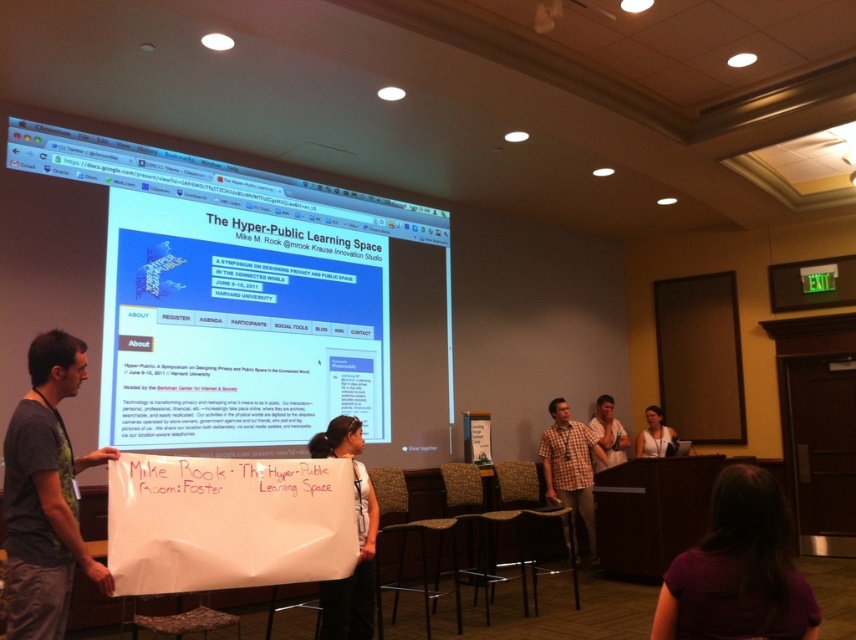
Question: Which point is closer to the camera taking this photo?

Choices:
 (A) (366, 634)
 (B) (646, 417)
 (C) (550, 445)

Answer: (A)

Question: Can you confirm if purple fabric shirt at lower center is positioned above white paperboard at center?

Choices:
 (A) yes
 (B) no

Answer: (A)

Question: Can you confirm if purple fabric shirt at lower center is wider than white paperboard at center?

Choices:
 (A) yes
 (B) no

Answer: (A)

Question: Based on their relative distances, which object is farther from the plaid shirt at center?

Choices:
 (A) gray fabric banner at left
 (B) checkered fabric shirt at center

Answer: (A)

Question: Which object is the closest to the white glossy projector screen at upper center?

Choices:
 (A) white fabric at center
 (B) plaid shirt at center

Answer: (B)

Question: Is white paperboard at center positioned in front of checkered fabric shirt at center?

Choices:
 (A) no
 (B) yes

Answer: (B)